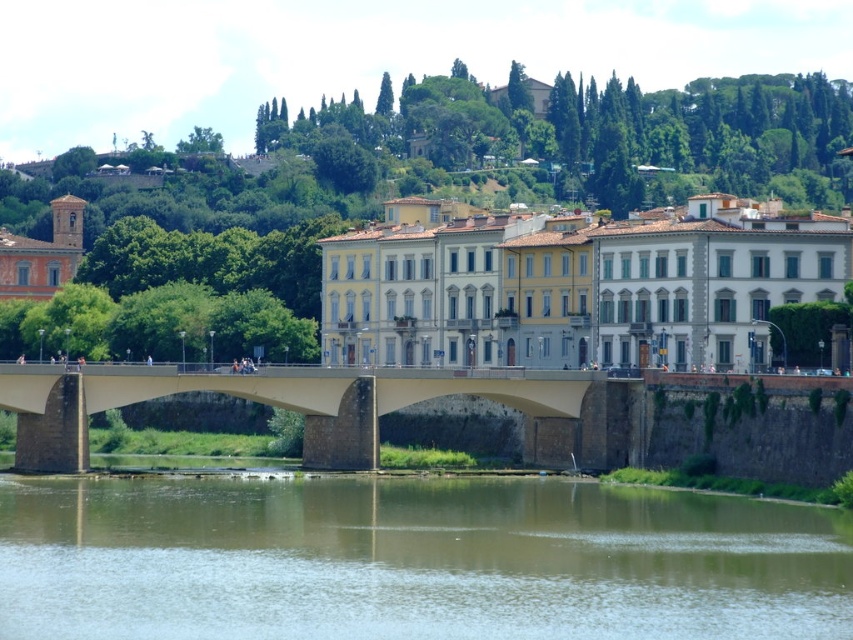
Consider the image. Which is above, brown sedimentary rock at lower center or concrete bridge at center?

Positioned higher is concrete bridge at center.

Is brown sedimentary rock at lower center bigger than concrete bridge at center?

Incorrect, brown sedimentary rock at lower center is not larger than concrete bridge at center.

Is point (831, 584) farther from viewer compared to point (82, 419)?

No, it is not.

The width and height of the screenshot is (853, 640). Identify the location of brown sedimentary rock at lower center. (412, 561).